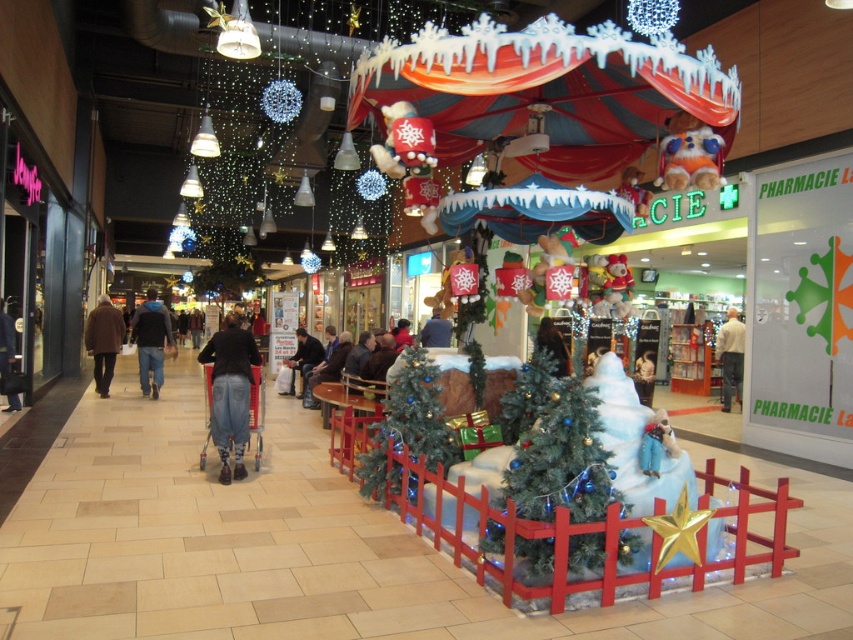
Between dark blue jeans at center and white cotton shirt at center, which one appears on the left side from the viewer's perspective?

dark blue jeans at center is more to the left.

Does dark blue jeans at center have a greater height compared to white cotton shirt at center?

Correct, dark blue jeans at center is much taller as white cotton shirt at center.

Does point (154, 364) come in front of point (721, 348)?

That is True.

I want to click on dark blue jeans at center, so click(x=151, y=340).

Is shiny blue plastic christmas tree at center thinner than denim jeans at center?

Indeed, shiny blue plastic christmas tree at center has a lesser width compared to denim jeans at center.

Can you confirm if shiny blue plastic christmas tree at center is taller than denim jeans at center?

In fact, shiny blue plastic christmas tree at center may be shorter than denim jeans at center.

Is point (537, 509) positioned after point (227, 336)?

That is False.

At what (x,y) coordinates should I click in order to perform the action: click on shiny blue plastic christmas tree at center. Please return your answer as a coordinate pair (x, y). Image resolution: width=853 pixels, height=640 pixels. Looking at the image, I should click on (561, 460).

What do you see at coordinates (561, 460) in the screenshot? The image size is (853, 640). I see `shiny blue plastic christmas tree at center` at bounding box center [561, 460].

Who is shorter, shiny blue plastic christmas tree at center or jeans at center?

shiny blue plastic christmas tree at center is shorter.

Locate an element on the screen. shiny blue plastic christmas tree at center is located at coordinates (561, 460).